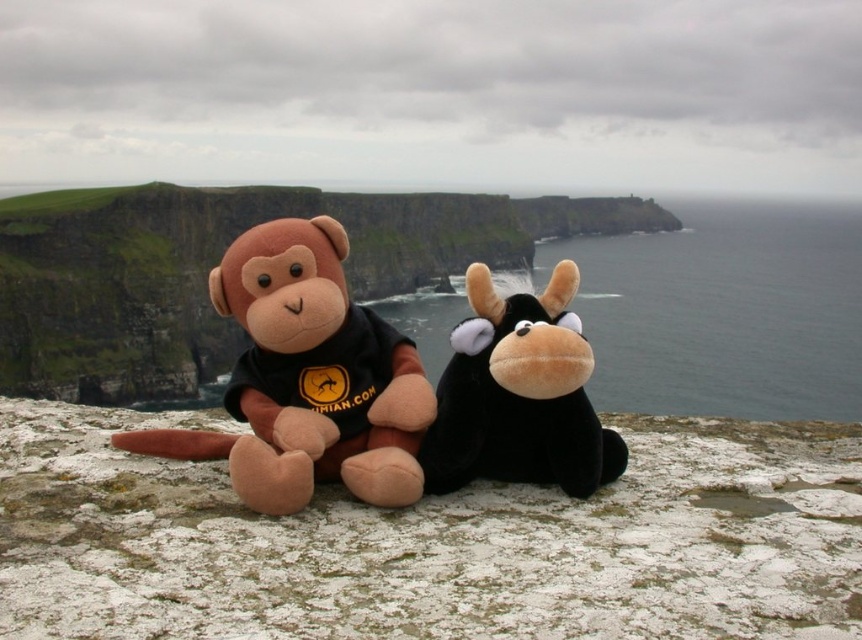
You are standing on the rocky coastal landscape and see the green grass cliff at center and the black plush cow at center. Which object is positioned to the right of the other?

The green grass cliff at center is positioned to the right of the black plush cow at center.

You are standing at the point marked as point (307, 378) in the image. Which object from the scene is located exactly at that point?

The point (307, 378) corresponds to the brown plush monkey at left.

You are standing at the point marked by the coordinates point (217, 262). Based on the scene description, what is the immediate terrain feature you are standing on?

The point (217, 262) corresponds to the green grass cliff at center, so you are standing on a green grass cliff.